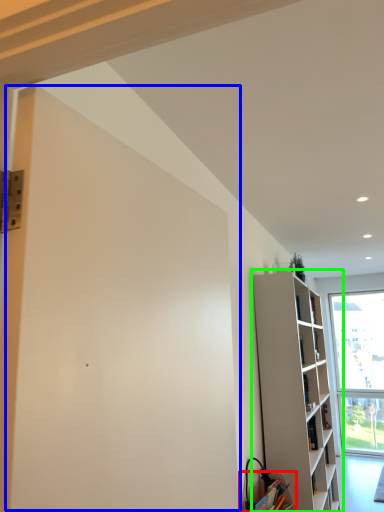
Question: Which is nearer to the cabinetry (highlighted by a red box)? screen door (highlighted by a blue box) or shelf (highlighted by a green box).

Choices:
 (A) screen door
 (B) shelf

Answer: (B)